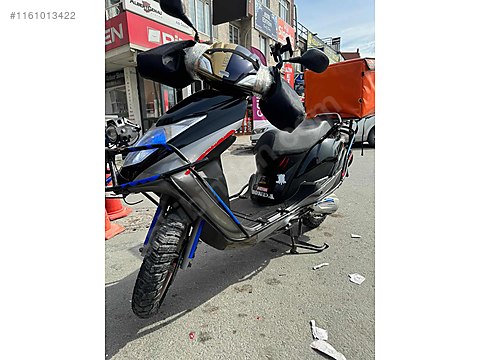
You are a GUI agent. You are given a task and a screenshot of the screen. Output one action in this format:
    pyautogui.click(x=<x>, y=<y>)
    Task: Click on the food container
    This screenshot has width=480, height=360.
    Given the screenshot: What is the action you would take?
    pyautogui.click(x=341, y=90)